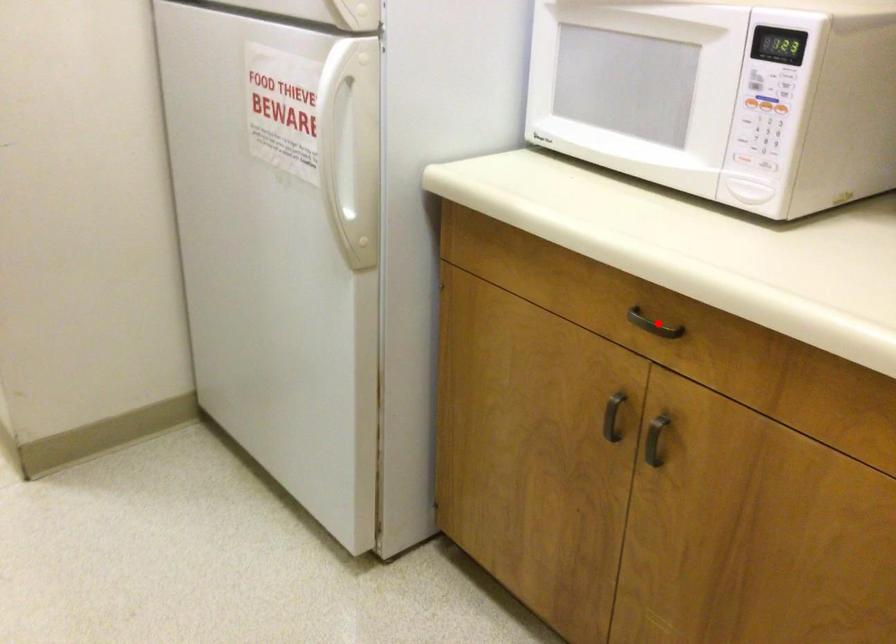
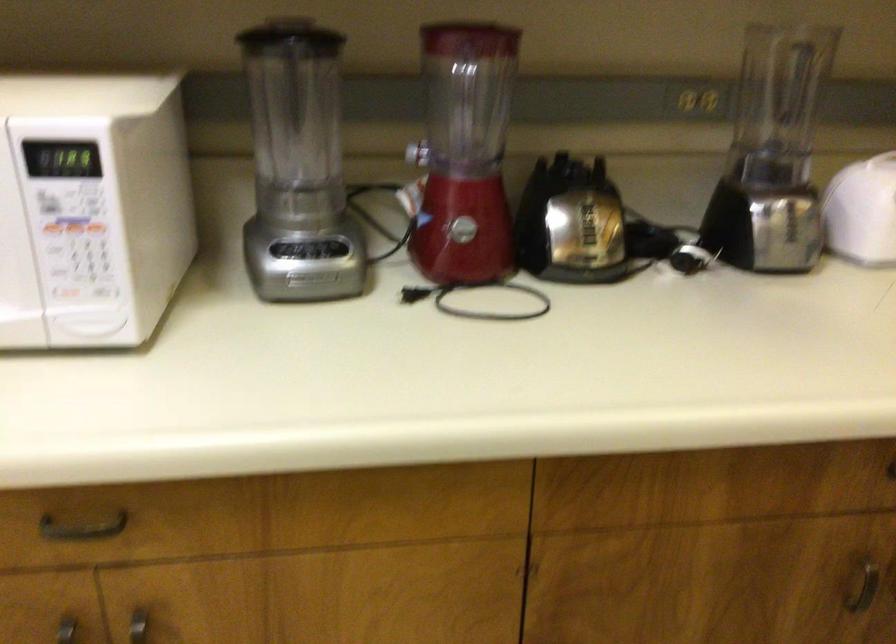
Locate, in the second image, the point that corresponds to the highlighted location in the first image.

(82, 527)